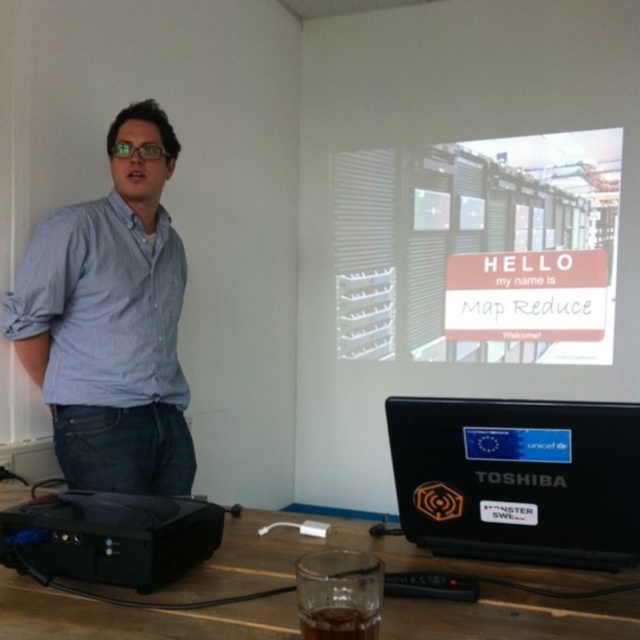
You are an attendee at the presentation. You need to reach the black plastic laptop at lower right to adjust the slide settings. However, there is a white matte signboard at upper center in your way. Can you move around it to access the laptop?

The black plastic laptop at lower right is behind the white matte signboard at upper center, so you can move around the white matte signboard at upper center to access the black plastic laptop at lower right.

You are a photographer setting up a shot of the presentation scene. You need to decide whether to focus on the blue denim jeans at left or the transparent glass at lower center first. Which object is wider in the image?

The blue denim jeans at left might be wider than transparent glass at lower center, so you should focus on the blue denim jeans at left first to ensure proper framing.

You are organizing the items on the table for the presentation. The brown glass at lower center needs to be moved to the upper right corner of the table. Which direction should you move it from its current position?

The brown glass at lower center is located at point (339,595), so to move it to the upper right corner of the table, you should move it upwards and slightly to the right.